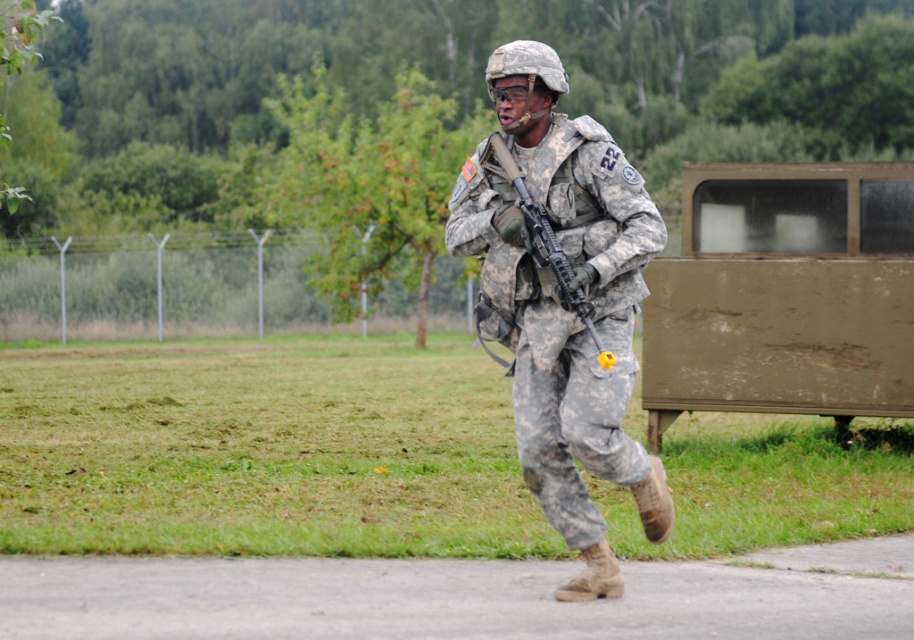
Question: Which object appears farthest from the camera in this image?

Choices:
 (A) matte black rifle at center
 (B) camouflage uniform at center

Answer: (B)

Question: Is camouflage uniform at center smaller than matte black rifle at center?

Choices:
 (A) yes
 (B) no

Answer: (B)

Question: Among these points, which one is nearest to the camera?

Choices:
 (A) (498, 362)
 (B) (583, 218)

Answer: (B)

Question: Does camouflage uniform at center come in front of matte black rifle at center?

Choices:
 (A) yes
 (B) no

Answer: (B)

Question: Is camouflage uniform at center behind matte black rifle at center?

Choices:
 (A) no
 (B) yes

Answer: (B)